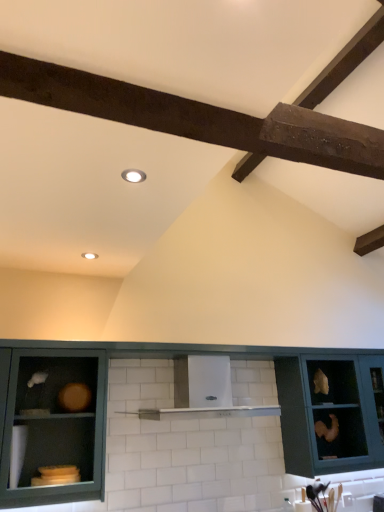
Question: Considering the relative sizes of matte teal cabinet at center, the 2th cabinetry in the left-to-right sequence, and matte green cabinet at lower left, acting as the 1th cabinetry starting from the left, in the image provided, is matte teal cabinet at center, the 2th cabinetry in the left-to-right sequence, thinner than matte green cabinet at lower left, acting as the 1th cabinetry starting from the left,?

Choices:
 (A) yes
 (B) no

Answer: (A)

Question: Is matte teal cabinet at center, the 2th cabinetry in the left-to-right sequence, closer to camera compared to matte green cabinet at lower left, acting as the 1th cabinetry starting from the left?

Choices:
 (A) yes
 (B) no

Answer: (B)

Question: Is matte teal cabinet at center, the 2th cabinetry in the left-to-right sequence, facing towards matte green cabinet at lower left, positioned as the third cabinetry in right-to-left order?

Choices:
 (A) no
 (B) yes

Answer: (B)

Question: From a real-world perspective, is matte teal cabinet at center, the 2th cabinetry in the left-to-right sequence, physically above matte green cabinet at lower left, acting as the 1th cabinetry starting from the left?

Choices:
 (A) no
 (B) yes

Answer: (A)

Question: Is matte teal cabinet at center, the 2th cabinetry in the left-to-right sequence, turned away from matte green cabinet at lower left, acting as the 1th cabinetry starting from the left?

Choices:
 (A) no
 (B) yes

Answer: (B)

Question: In the image, is matte teal cabinet at center, the 2th cabinetry in the left-to-right sequence, on the left side or the right side of matte teal cabinet at right, which ranks as the 1th cabinetry in right-to-left order?

Choices:
 (A) right
 (B) left

Answer: (B)

Question: Based on their sizes in the image, would you say matte teal cabinet at center, placed as the 2th cabinetry when sorted from right to left, is bigger or smaller than matte teal cabinet at right, which ranks as the 1th cabinetry in right-to-left order?

Choices:
 (A) big
 (B) small

Answer: (B)

Question: From the image's perspective, is matte teal cabinet at center, the 2th cabinetry in the left-to-right sequence, above or below matte teal cabinet at right, which ranks as the 1th cabinetry in right-to-left order?

Choices:
 (A) below
 (B) above

Answer: (A)

Question: Considering the positions of matte teal cabinet at center, placed as the 2th cabinetry when sorted from right to left, and matte teal cabinet at right, the third cabinetry in the left-to-right sequence, in the image, is matte teal cabinet at center, placed as the 2th cabinetry when sorted from right to left, taller or shorter than matte teal cabinet at right, the third cabinetry in the left-to-right sequence,?

Choices:
 (A) short
 (B) tall

Answer: (B)

Question: Would you say matte green cabinet at lower left, positioned as the third cabinetry in right-to-left order, is to the left or to the right of white glossy vent at center in the picture?

Choices:
 (A) right
 (B) left

Answer: (B)

Question: From the image's perspective, is matte green cabinet at lower left, acting as the 1th cabinetry starting from the left, above or below white glossy vent at center?

Choices:
 (A) above
 (B) below

Answer: (B)

Question: Choose the correct answer: Is matte green cabinet at lower left, acting as the 1th cabinetry starting from the left, inside white glossy vent at center or outside it?

Choices:
 (A) outside
 (B) inside

Answer: (A)

Question: Looking at the image, does matte green cabinet at lower left, acting as the 1th cabinetry starting from the left, seem bigger or smaller compared to white glossy vent at center?

Choices:
 (A) small
 (B) big

Answer: (A)

Question: From a real-world perspective, relative to matte teal cabinet at center, the 2th cabinetry in the left-to-right sequence, is white glossy vent at center vertically above or below?

Choices:
 (A) below
 (B) above

Answer: (B)

Question: In terms of height, does white glossy vent at center look taller or shorter compared to matte teal cabinet at center, placed as the 2th cabinetry when sorted from right to left?

Choices:
 (A) short
 (B) tall

Answer: (A)